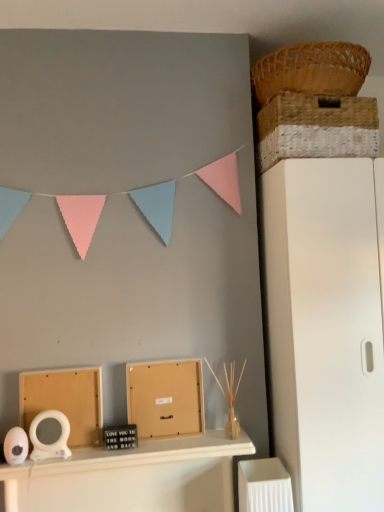
Question: Is woven straw basket at upper right, which appears as the 2th basket when viewed from the top, wider or thinner than white matte file cabinet at right?

Choices:
 (A) wide
 (B) thin

Answer: (B)

Question: Choose the correct answer: Is woven straw basket at upper right, the 1th basket ordered from the bottom, inside white matte file cabinet at right or outside it?

Choices:
 (A) inside
 (B) outside

Answer: (B)

Question: Which is nearer to the white matte file cabinet at right?

Choices:
 (A) woven straw basket at upper right, the 1th basket ordered from the bottom
 (B) white glossy mirror at center
 (C) matte cardboard box at lower left, which is the 1th cardboard box in left-to-right order
 (D) matte cardboard box at center, acting as the first cardboard box starting from the right
 (E) woven brown basket at upper right, which ranks as the second basket in bottom-to-top order

Answer: (D)

Question: Which object is positioned farthest from the matte cardboard box at lower left, which is the 1th cardboard box in left-to-right order?

Choices:
 (A) white glossy mirror at center
 (B) white matte file cabinet at right
 (C) matte cardboard box at center, acting as the first cardboard box starting from the right
 (D) woven brown basket at upper right, which is the 1th basket from top to bottom
 (E) woven straw basket at upper right, the 1th basket ordered from the bottom

Answer: (D)